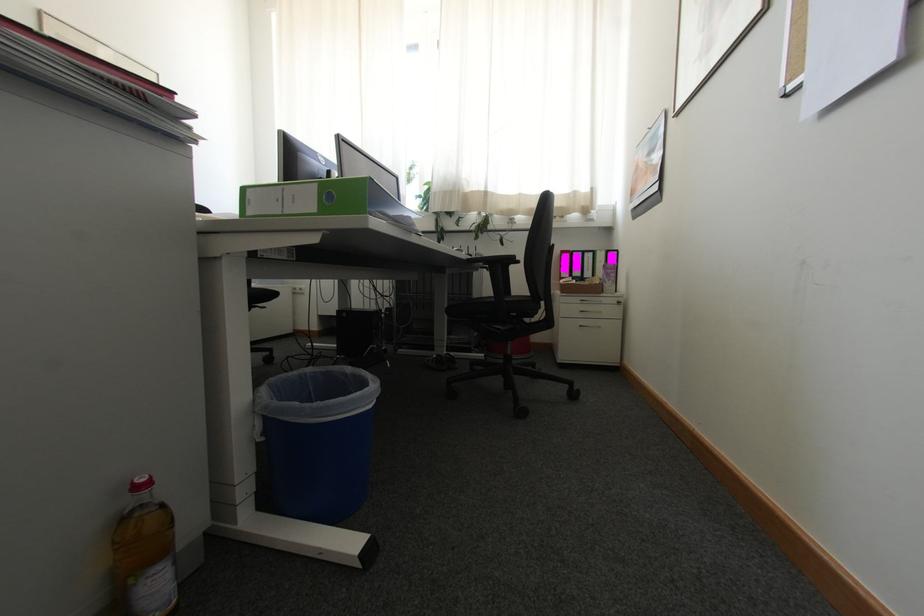
Where would you twist the red bottle cap? Please return your answer as a coordinate pair (x, y).

(140, 485)